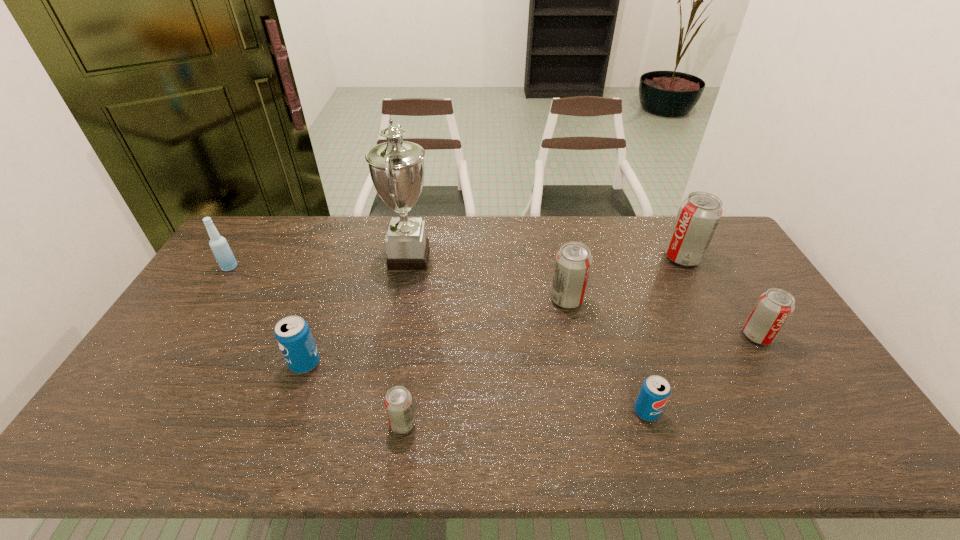
Find the location of a particular element. This screenshot has width=960, height=540. vacant space situated on the right of the third soda can from right to left is located at coordinates (792, 411).

Locate an element on the screen. vacant area situated 0.220m on the left of the leftmost gray soda can is located at coordinates (299, 423).

Locate an element on the screen. trophy cup at the far edge is located at coordinates (396, 167).

Identify the location of soda can positioned at the far edge. (699, 214).

I want to click on object that is at the near edge, so click(398, 403).

The width and height of the screenshot is (960, 540). Identify the location of object situated at the left edge. (219, 246).

At what (x,y) coordinates should I click in order to perform the action: click on object at the far right corner. Please return your answer as a coordinate pair (x, y). Looking at the image, I should click on (699, 214).

You are a GUI agent. You are given a task and a screenshot of the screen. Output one action in this format:
    pyautogui.click(x=<x>, y=<y>)
    Task: Click on the free space at the far edge of the desktop
    Image resolution: width=960 pixels, height=540 pixels.
    Given the screenshot: What is the action you would take?
    pyautogui.click(x=279, y=254)

This screenshot has height=540, width=960. Find the location of `vacant space at the left edge of the desktop`. vacant space at the left edge of the desktop is located at coordinates (158, 375).

Find the location of a particular element. This screenshot has height=540, width=960. vacant point at the right edge is located at coordinates click(x=810, y=357).